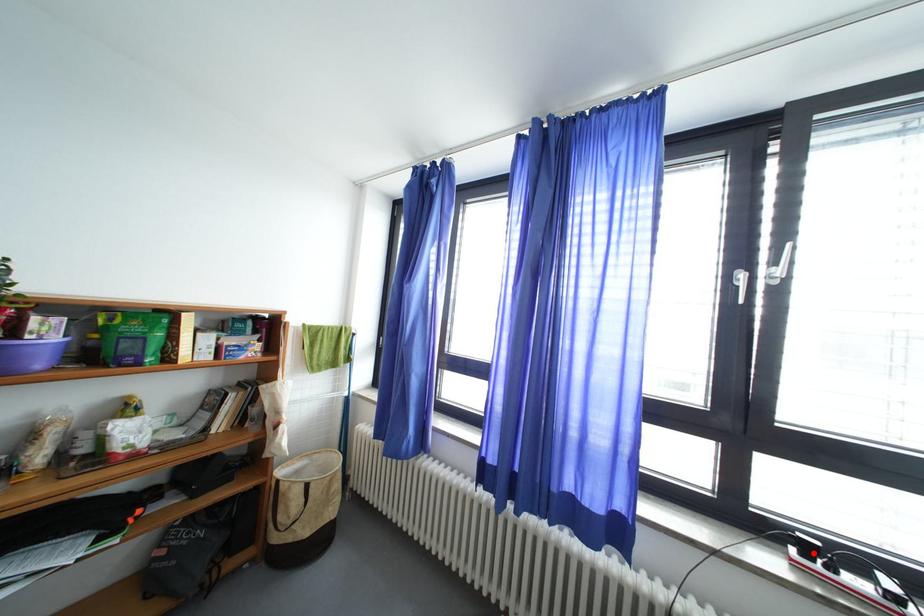
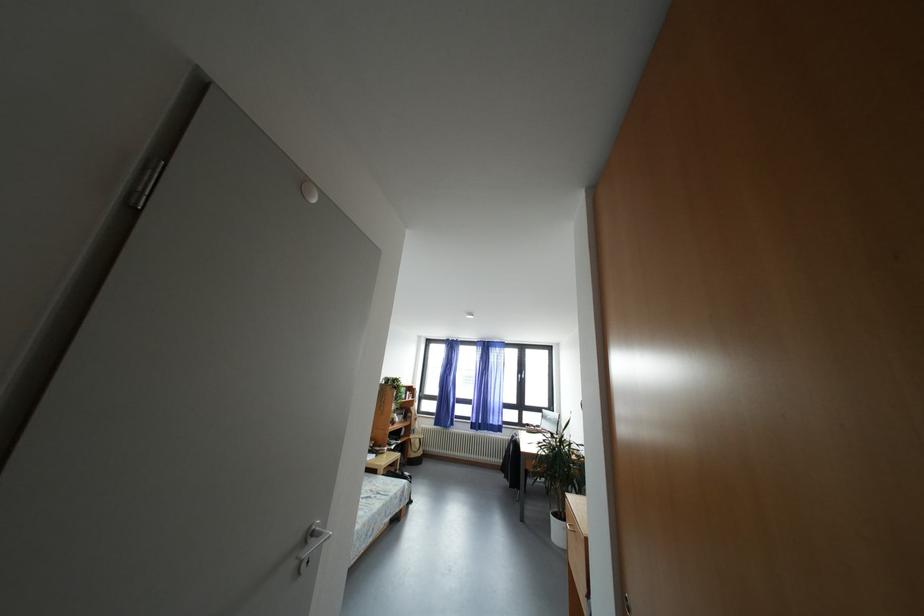
Question: I am providing you with two images of the same scene from different viewpoints. Given a red point in image1, look at the same physical point in image2. Is it:

Choices:
 (A) Closer to the viewpoint
 (B) Farther from the viewpoint

Answer: (B)